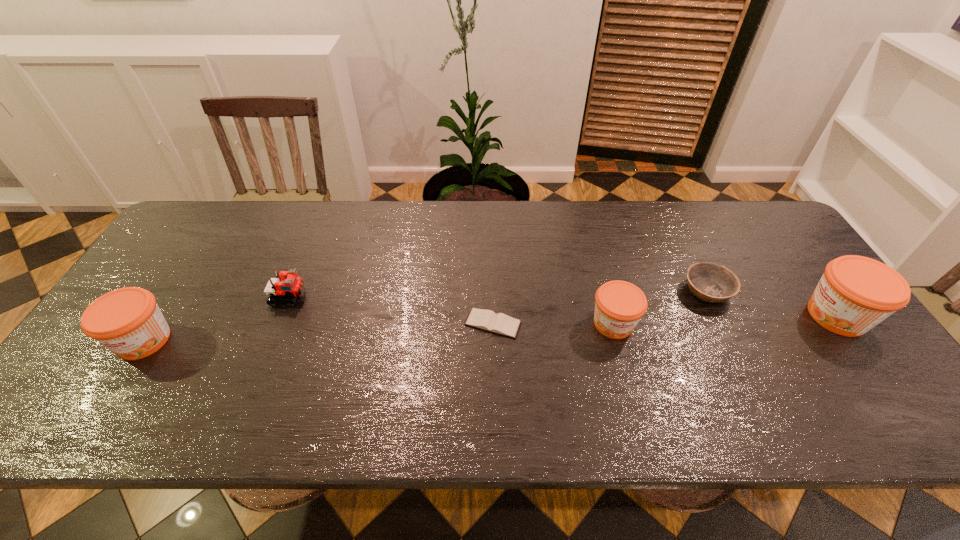
Find the location of a particular element. Image resolution: width=960 pixels, height=540 pixels. blank space located 0.060m on the front label of the second shortest jam is located at coordinates (x=112, y=389).

Where is `vacant region located 0.070m on the front label of the third object from right to left`? This screenshot has height=540, width=960. vacant region located 0.070m on the front label of the third object from right to left is located at coordinates point(625,368).

Locate an element on the screen. blank space located on the front label of the rightmost object is located at coordinates (693, 315).

The height and width of the screenshot is (540, 960). Identify the location of vacant space situated on the front label of the rightmost object. (708, 315).

This screenshot has height=540, width=960. I want to click on free location located 0.390m on the front label of the rightmost object, so click(655, 315).

At what (x,y) coordinates should I click in order to perform the action: click on vacant space positioned on the back of the second shortest object. Please return your answer as a coordinate pair (x, y). The height and width of the screenshot is (540, 960). Looking at the image, I should click on (679, 233).

This screenshot has height=540, width=960. I want to click on vacant space located on the back of the shortest object, so click(491, 219).

The width and height of the screenshot is (960, 540). What are the coordinates of `free point located on the front-facing side of the Lego` in the screenshot? It's located at (453, 296).

What are the coordinates of `object at the near edge` in the screenshot? It's located at (127, 321).

This screenshot has height=540, width=960. I want to click on object that is at the left edge, so click(x=127, y=321).